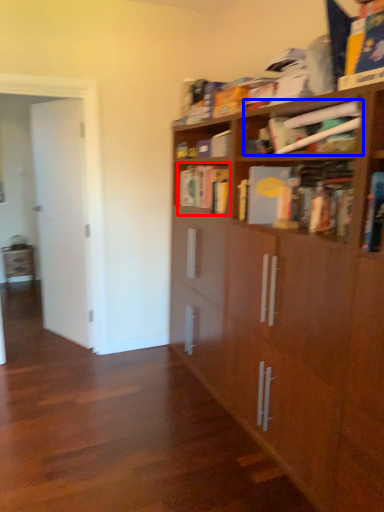
Question: Which of the following is the farthest to the observer, book (highlighted by a red box) or book (highlighted by a blue box)?

Choices:
 (A) book
 (B) book

Answer: (A)